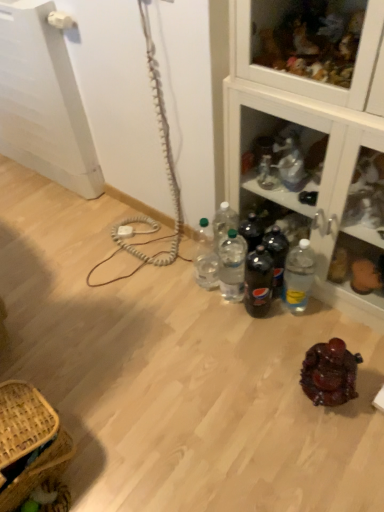
The height and width of the screenshot is (512, 384). In order to click on free space in front of translucent plastic soda bottles at center, which is counted as the second bottle, starting from the right in this screenshot , I will do `click(281, 332)`.